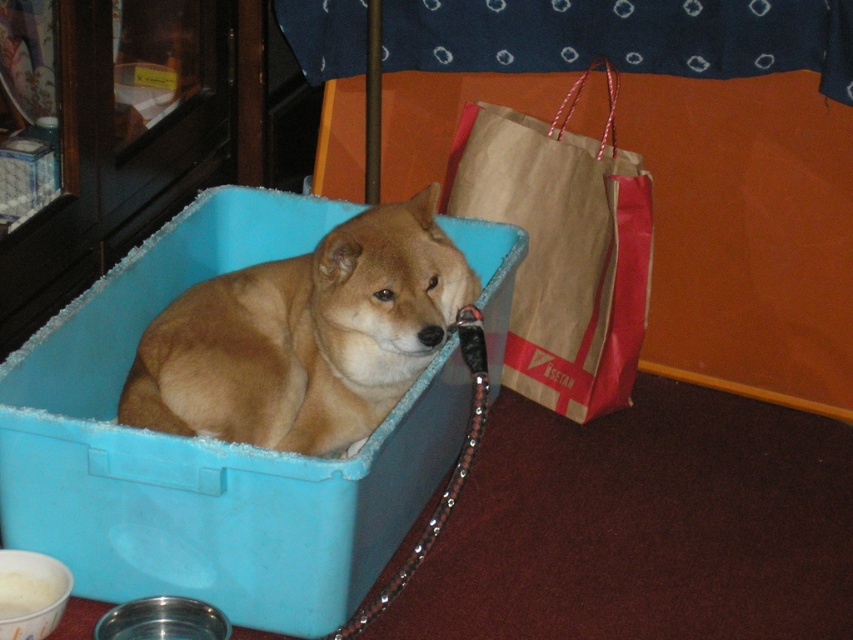
What do you see at coordinates (305, 337) in the screenshot? This screenshot has width=853, height=640. I see `brown fur dog at center` at bounding box center [305, 337].

This screenshot has width=853, height=640. Find the location of `brown fur dog at center`. brown fur dog at center is located at coordinates (305, 337).

From the picture: Can you confirm if blue plastic box at center is shorter than brown fur dog at center?

In fact, blue plastic box at center may be taller than brown fur dog at center.

Where is `blue plastic box at center`? blue plastic box at center is located at coordinates tap(207, 448).

Does point (39, 428) come farther from viewer compared to point (595, 362)?

No.

From the picture: Is blue plastic box at center below brown paper bag at right?

Yes.

Locate an element on the screen. This screenshot has width=853, height=640. blue plastic box at center is located at coordinates (207, 448).

Locate an element on the screen. blue plastic box at center is located at coordinates click(207, 448).